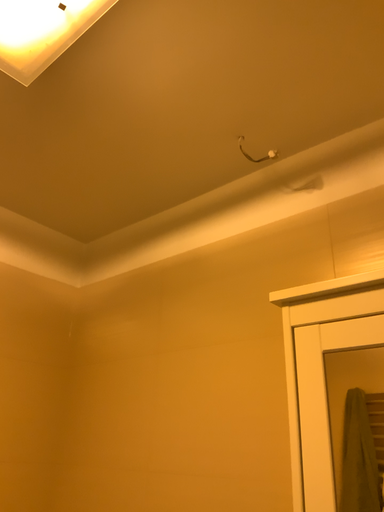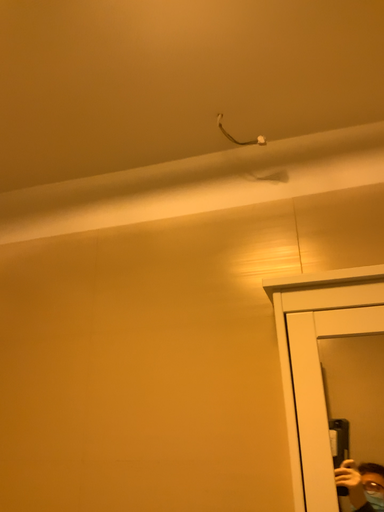
Question: Which way did the camera rotate in the video?

Choices:
 (A) rotated right
 (B) rotated left

Answer: (A)